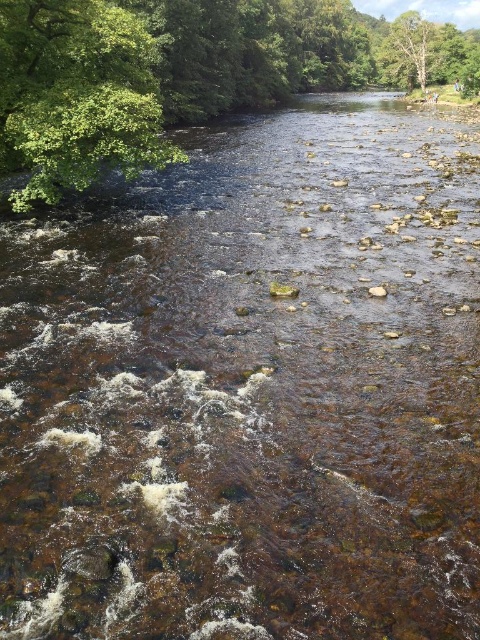
You are a photographer standing at the riverbank and want to capture both the point at coordinates (180,83) and the point at coordinates (408,29) in your shot. Based on their positions, which point will appear larger in your photo?

Point (180,83) is closer to the camera than point (408,29), so it will appear larger in the photo.

You are a bird flying over the river scene. You want to land on a tree branch. Which tree should you choose if you want to land on the tree that is closer to you, the green leafy tree at left or the green leafy tree at upper right?

The green leafy tree at left is closer to you because it is in front of the green leafy tree at upper right, so you should choose the green leafy tree at left.